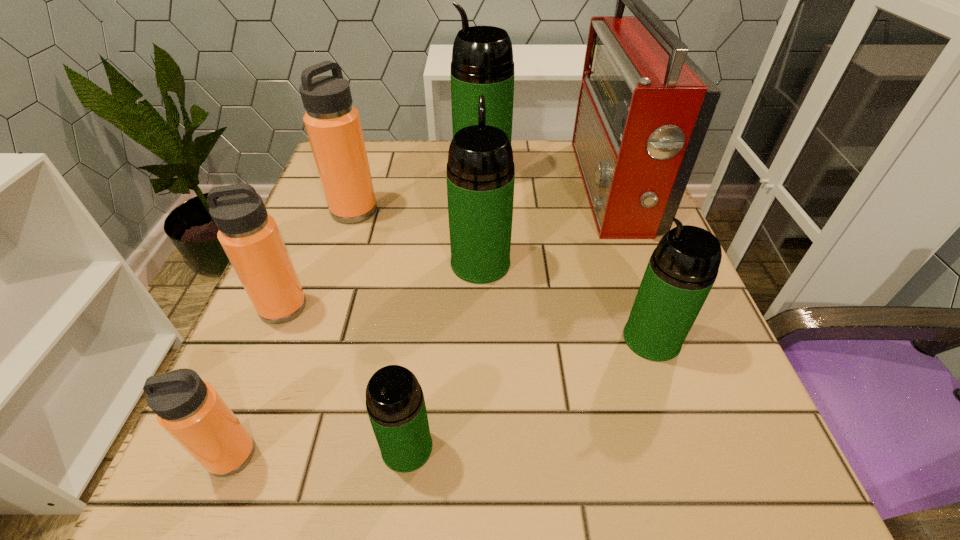
Identify which thermos bottle is the third nearest to the farthest green thermos bottle. Please provide its 2D coordinates. Your answer should be formatted as a tuple, i.e. [(x, y)], where the tuple contains the x and y coordinates of a point satisfying the conditions above.

[(250, 237)]

The width and height of the screenshot is (960, 540). I want to click on thermos bottle object that ranks as the fourth closest to the second biggest orange thermos bottle, so click(x=480, y=174).

Find the location of a particular element. This screenshot has width=960, height=540. green thermos bottle that is the second nearest to the radio receiver is located at coordinates (480, 174).

Find the location of a particular element. The image size is (960, 540). the second closest green thermos bottle to the second smallest green thermos bottle is located at coordinates (395, 403).

Choose which orange thermos bottle is the second nearest neighbor to the smallest green thermos bottle. Please provide its 2D coordinates. Your answer should be formatted as a tuple, i.e. [(x, y)], where the tuple contains the x and y coordinates of a point satisfying the conditions above.

[(250, 237)]

Where is `orange thermos bottle object that ranks as the closest to the nearest orange thermos bottle`? orange thermos bottle object that ranks as the closest to the nearest orange thermos bottle is located at coordinates (250, 237).

The image size is (960, 540). I want to click on free location that satisfies the following two spatial constraints: 1. on the front-facing side of the radio receiver; 2. from the spout of the nearest green thermos bottle, so click(x=709, y=447).

Find the location of a particular element. The height and width of the screenshot is (540, 960). vacant area that satisfies the following two spatial constraints: 1. from the spout of the tallest thermos bottle; 2. from the spout of the smallest green thermos bottle is located at coordinates (484, 447).

The width and height of the screenshot is (960, 540). Find the location of `free space that satisfies the following two spatial constraints: 1. from the spout of the rightmost green thermos bottle; 2. from the spout of the nearest green thermos bottle`. free space that satisfies the following two spatial constraints: 1. from the spout of the rightmost green thermos bottle; 2. from the spout of the nearest green thermos bottle is located at coordinates (688, 447).